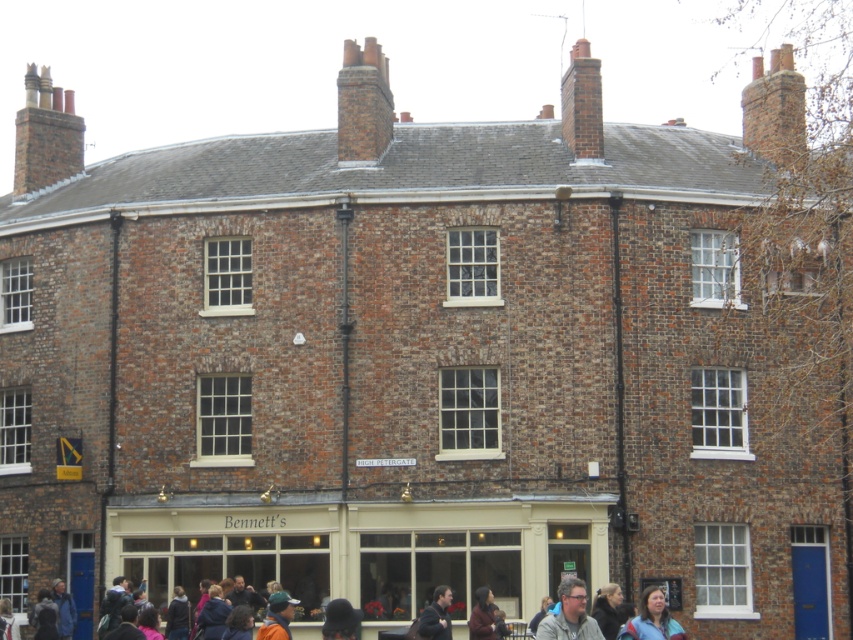
Question: Can you confirm if dark blue jacket at lower center is bigger than dark brown leather jacket at lower center?

Choices:
 (A) yes
 (B) no

Answer: (A)

Question: Can you confirm if dark blue jacket at lower center is bigger than dark brown leather jacket at lower center?

Choices:
 (A) yes
 (B) no

Answer: (A)

Question: Based on their relative distances, which object is farther from the matte gray glasses at lower center?

Choices:
 (A) dark brown leather jacket at lower center
 (B) dark blue jacket at lower center

Answer: (A)

Question: Which point is closer to the camera?

Choices:
 (A) matte gray glasses at lower center
 (B) blue fabric jacket at lower right

Answer: (A)

Question: In this image, where is matte gray glasses at lower center located relative to blue fabric jacket at lower right?

Choices:
 (A) right
 (B) left

Answer: (B)

Question: Among these objects, which one is nearest to the camera?

Choices:
 (A) dark blue jacket at lower center
 (B) blue fabric jacket at lower right
 (C) dark brown leather jacket at lower center

Answer: (A)